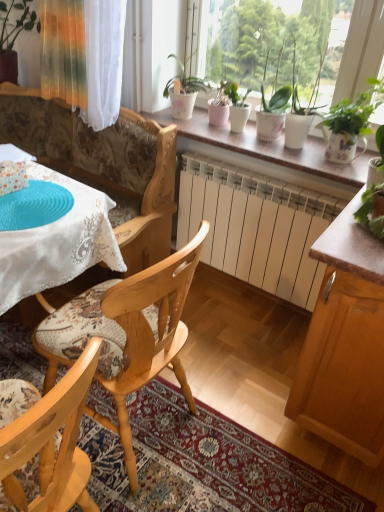
Where is `empty space that is in between matte brown cabinet at right and wooden placemat at lower center`? empty space that is in between matte brown cabinet at right and wooden placemat at lower center is located at coordinates (245, 377).